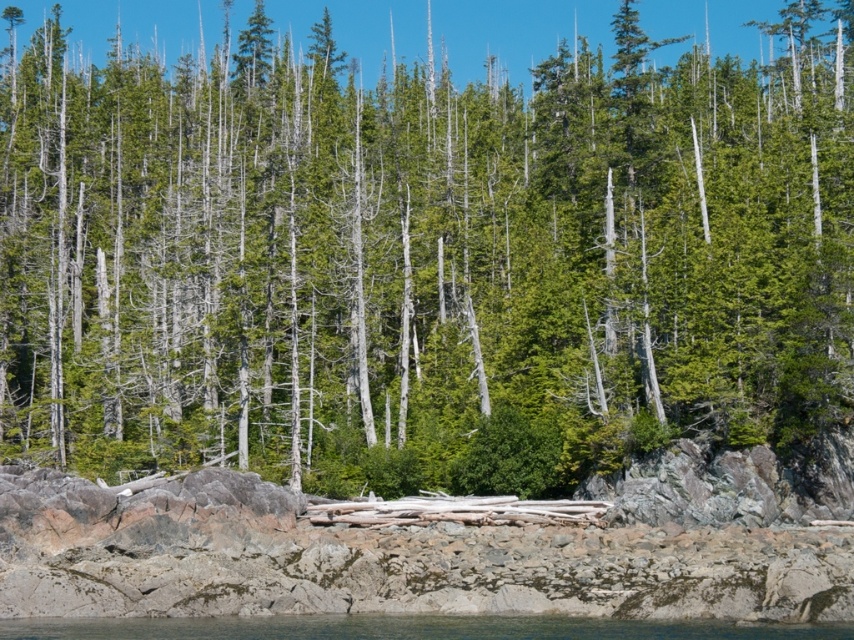
Question: Is gray rock at lower center below clear water at lower center?

Choices:
 (A) no
 (B) yes

Answer: (A)

Question: Which point is closer to the camera taking this photo?

Choices:
 (A) (151, 624)
 (B) (686, 556)

Answer: (A)

Question: Can you confirm if gray rock at lower center is smaller than clear water at lower center?

Choices:
 (A) no
 (B) yes

Answer: (A)

Question: Among these points, which one is farthest from the camera?

Choices:
 (A) (255, 632)
 (B) (495, 586)

Answer: (B)

Question: Can you confirm if gray rock at lower center is smaller than clear water at lower center?

Choices:
 (A) no
 (B) yes

Answer: (A)

Question: Which of the following is the farthest from the observer?

Choices:
 (A) (135, 611)
 (B) (624, 637)

Answer: (A)